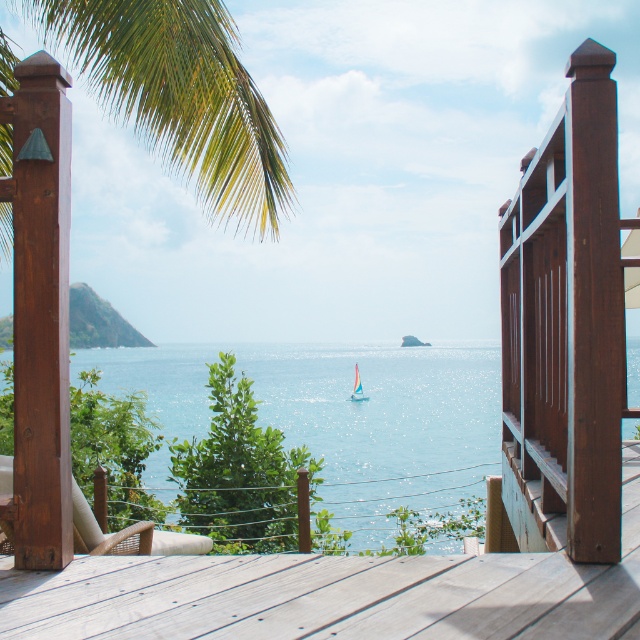
You are standing on the wooden deck and want to take a photo of both the point at coordinates point (452, 384) and point (355, 384). Which point should you focus on first to ensure both are in focus?

You should focus on point (452, 384) first because it is closer to the camera than point (355, 384), ensuring both points are within the depth of field.

You are standing on the wooden deck and want to walk towards both the blue water at center and the green leafy palm tree at upper left. Which object will you encounter first as you move forward?

You will encounter the blue water at center first because it is closer to you than the green leafy palm tree at upper left, which is further away.